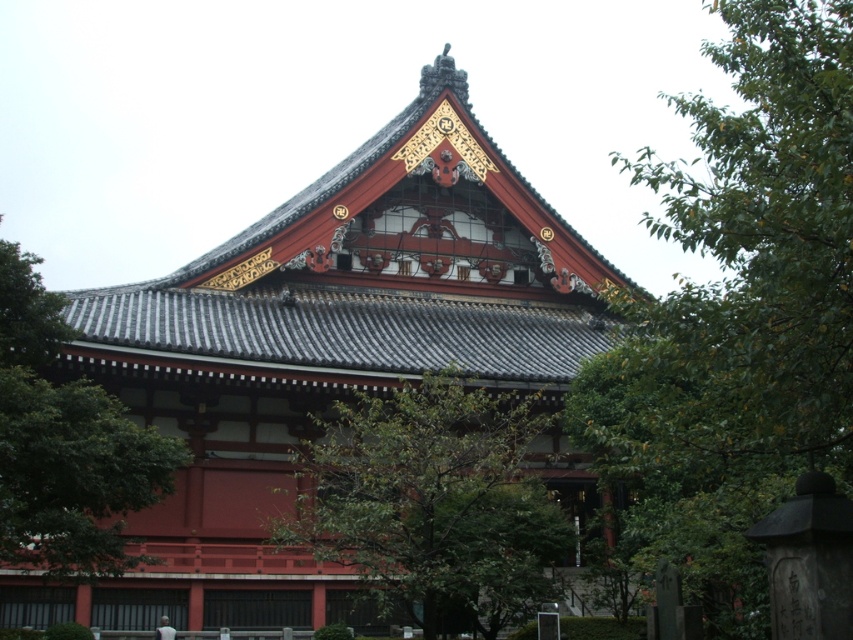
The image size is (853, 640). What do you see at coordinates (431, 502) in the screenshot? I see `green leafy tree at center` at bounding box center [431, 502].

Is green leafy tree at center shorter than green leafy tree at upper left?

Yes.

Locate an element on the screen. green leafy tree at center is located at coordinates point(431,502).

Is green leafy tree at upper right positioned at the back of green leafy tree at upper left?

No.

Does green leafy tree at upper right appear on the left side of green leafy tree at upper left?

Incorrect, green leafy tree at upper right is not on the left side of green leafy tree at upper left.

Is point (715, 570) more distant than point (0, 289)?

No, (715, 570) is in front of (0, 289).

Where is `green leafy tree at upper right`? Image resolution: width=853 pixels, height=640 pixels. green leafy tree at upper right is located at coordinates (738, 314).

From the picture: Which is above, green leafy tree at upper right or green leafy tree at center?

green leafy tree at upper right is higher up.

Does point (717, 160) come in front of point (392, 563)?

Yes, it is.

The image size is (853, 640). What are the coordinates of `green leafy tree at upper right` in the screenshot? It's located at (738, 314).